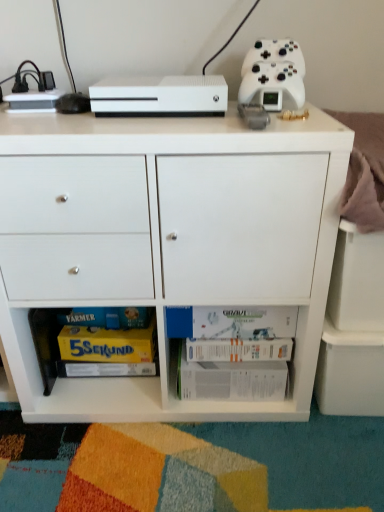
Question: From the image's perspective, does white matte cabinet at center appear higher than yellow cardboard magazine at lower left?

Choices:
 (A) yes
 (B) no

Answer: (A)

Question: Is white matte cabinet at center bigger than yellow cardboard magazine at lower left?

Choices:
 (A) no
 (B) yes

Answer: (B)

Question: From a real-world perspective, is white matte cabinet at center under yellow cardboard magazine at lower left?

Choices:
 (A) no
 (B) yes

Answer: (A)

Question: Are white matte cabinet at center and yellow cardboard magazine at lower left far apart?

Choices:
 (A) yes
 (B) no

Answer: (B)

Question: From a real-world perspective, is white matte cabinet at center over yellow cardboard magazine at lower left?

Choices:
 (A) no
 (B) yes

Answer: (B)

Question: Is white matte cabinet at center oriented away from yellow cardboard magazine at lower left?

Choices:
 (A) no
 (B) yes

Answer: (B)

Question: Can you confirm if yellow cardboard magazine at lower left is bigger than white paper book at lower center, which appears as the first book when ordered from the bottom?

Choices:
 (A) yes
 (B) no

Answer: (B)

Question: Is the position of yellow cardboard magazine at lower left more distant than that of white paper book at lower center, which appears as the first book when ordered from the bottom?

Choices:
 (A) no
 (B) yes

Answer: (B)

Question: From the image's perspective, would you say yellow cardboard magazine at lower left is positioned over white paper book at lower center, which appears as the first book when ordered from the bottom?

Choices:
 (A) yes
 (B) no

Answer: (A)

Question: Can white paper book at lower center, the 2th book in the top-to-bottom sequence, be found inside yellow cardboard magazine at lower left?

Choices:
 (A) no
 (B) yes

Answer: (A)

Question: Is yellow cardboard magazine at lower left closer to the viewer compared to white paper book at lower center, the 2th book in the top-to-bottom sequence?

Choices:
 (A) yes
 (B) no

Answer: (B)

Question: Does yellow cardboard magazine at lower left have a greater height compared to white paper book at lower center, the 2th book in the top-to-bottom sequence?

Choices:
 (A) no
 (B) yes

Answer: (A)

Question: From a real-world perspective, is white matte board game at lower center, the 1th book from the top, on white paper book at lower center, which appears as the first book when ordered from the bottom?

Choices:
 (A) no
 (B) yes

Answer: (B)